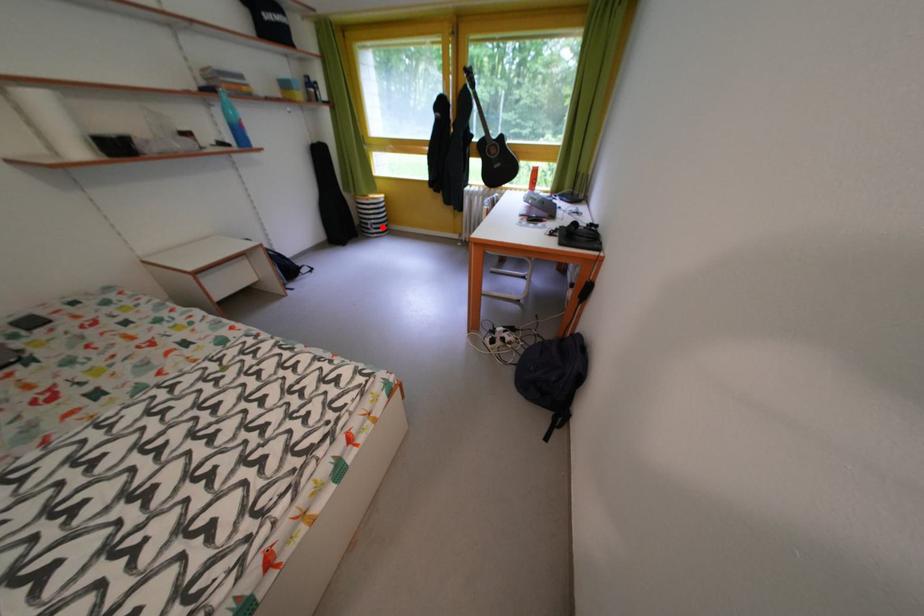
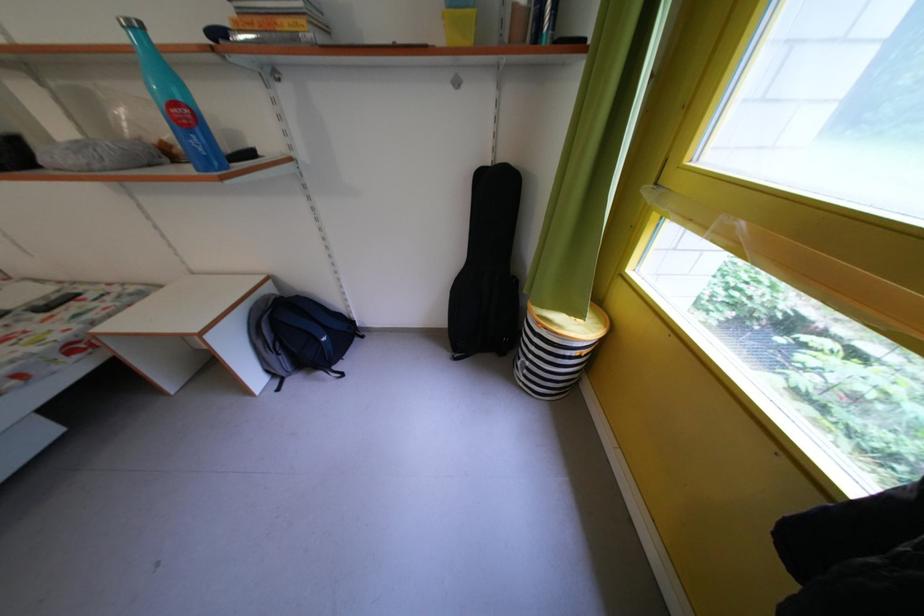
Locate, in the second image, the point that corresponds to the highlighted location in the first image.

(537, 369)